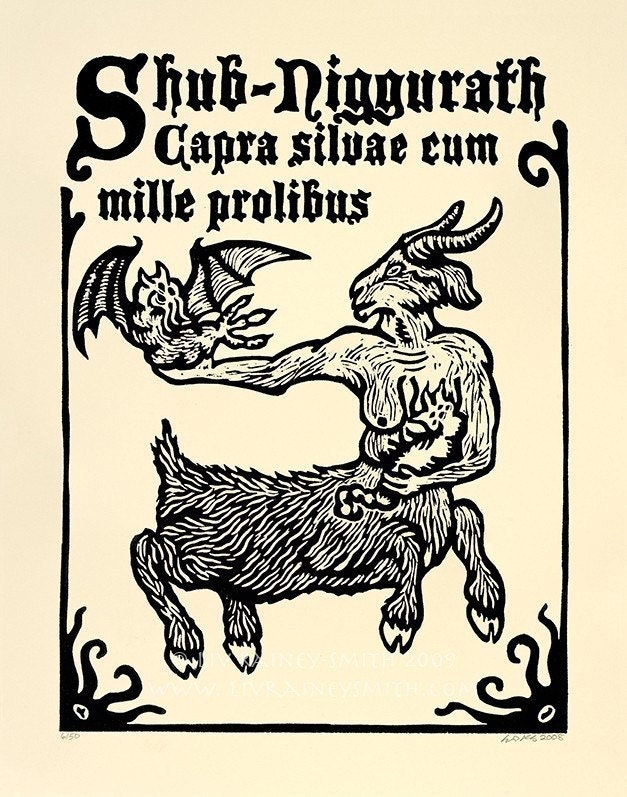
Where is `poster`? This screenshot has height=797, width=627. poster is located at coordinates (260, 383).